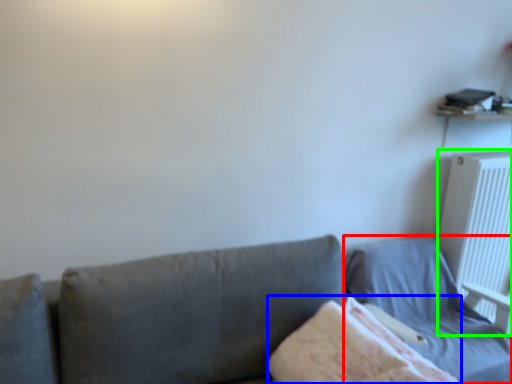
Question: Which object is the closest to the bed (highlighted by a red box)? Choose among these: blanket (highlighted by a blue box) or radiator (highlighted by a green box).

Choices:
 (A) blanket
 (B) radiator

Answer: (B)